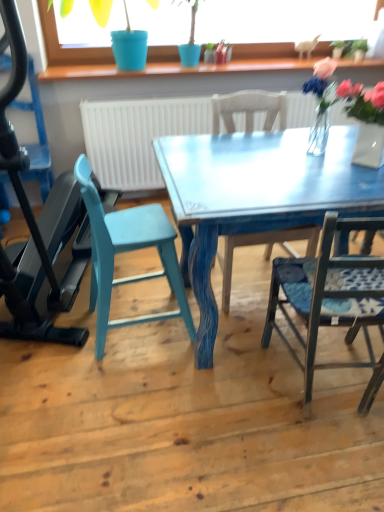
Question: Is metallic blue chair at right, which is the 1th chair in right-to-left order, to the right of translucent glass vase at upper right, the second floral arrangement when ordered from right to left, from the viewer's perspective?

Choices:
 (A) no
 (B) yes

Answer: (B)

Question: Can you confirm if metallic blue chair at right, the 4th chair in the left-to-right sequence, is bigger than translucent glass vase at upper right, the 1th floral arrangement in the left-to-right sequence?

Choices:
 (A) yes
 (B) no

Answer: (A)

Question: Is metallic blue chair at right, the 4th chair in the left-to-right sequence, placed right next to translucent glass vase at upper right, the 1th floral arrangement in the left-to-right sequence?

Choices:
 (A) no
 (B) yes

Answer: (A)

Question: From a real-world perspective, is metallic blue chair at right, the 4th chair in the left-to-right sequence, on top of translucent glass vase at upper right, the second floral arrangement when ordered from right to left?

Choices:
 (A) yes
 (B) no

Answer: (B)

Question: Is metallic blue chair at right, the 4th chair in the left-to-right sequence, thinner than translucent glass vase at upper right, the second floral arrangement when ordered from right to left?

Choices:
 (A) no
 (B) yes

Answer: (A)

Question: From their relative heights in the image, would you say teal painted wood chair at lower left, positioned as the 3th chair in right-to-left order, is taller or shorter than teal painted wood chair at left, which ranks as the first chair in left-to-right order?

Choices:
 (A) short
 (B) tall

Answer: (A)

Question: Is teal painted wood chair at lower left, which appears as the second chair when viewed from the left, to the left or to the right of teal painted wood chair at left, which is the fourth chair in right-to-left order, in the image?

Choices:
 (A) left
 (B) right

Answer: (B)

Question: In terms of size, does teal painted wood chair at lower left, positioned as the 3th chair in right-to-left order, appear bigger or smaller than teal painted wood chair at left, which ranks as the first chair in left-to-right order?

Choices:
 (A) big
 (B) small

Answer: (A)

Question: Looking at their shapes, would you say teal painted wood chair at lower left, which appears as the second chair when viewed from the left, is wider or thinner than teal painted wood chair at left, which ranks as the first chair in left-to-right order?

Choices:
 (A) wide
 (B) thin

Answer: (B)

Question: Is blue plastic pot at upper center situated inside blue fabric chair at center, which appears as the third chair when viewed from the left, or outside?

Choices:
 (A) outside
 (B) inside

Answer: (A)

Question: Is point (109, 53) positioned closer to the camera than point (286, 96)?

Choices:
 (A) closer
 (B) farther

Answer: (B)

Question: Considering the positions of blue plastic pot at upper center and blue fabric chair at center, the 2th chair viewed from the right, in the image, is blue plastic pot at upper center taller or shorter than blue fabric chair at center, the 2th chair viewed from the right,?

Choices:
 (A) short
 (B) tall

Answer: (A)

Question: Considering their positions, is blue plastic pot at upper center located in front of or behind blue fabric chair at center, which appears as the third chair when viewed from the left?

Choices:
 (A) behind
 (B) front

Answer: (A)

Question: Do you think translucent glass vase at upper right, the 1th floral arrangement in the left-to-right sequence, is within clear glass vase at upper right, the first floral arrangement positioned from the right, or outside of it?

Choices:
 (A) outside
 (B) inside

Answer: (A)

Question: Considering the relative positions of translucent glass vase at upper right, the second floral arrangement when ordered from right to left, and clear glass vase at upper right, the second floral arrangement when ordered from left to right, in the image provided, is translucent glass vase at upper right, the second floral arrangement when ordered from right to left, to the left or to the right of clear glass vase at upper right, the second floral arrangement when ordered from left to right,?

Choices:
 (A) left
 (B) right

Answer: (A)